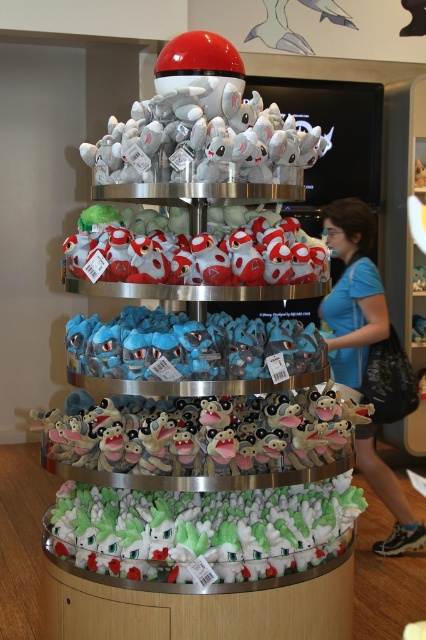
Where is `white plush toys at center`? The width and height of the screenshot is (426, 640). white plush toys at center is located at coordinates point(201,342).

Between point (184, 244) and point (112, 492), which one is positioned in front?

Point (112, 492) is more forward.

Where is `white plush toys at center`? white plush toys at center is located at coordinates (201, 342).

Between point (66, 243) and point (100, 344), which one is positioned in front?

Positioned in front is point (100, 344).

Is point (141, 552) positioned in front of point (195, 365)?

Yes, point (141, 552) is closer to viewer.

Is point (166, 513) closer to viewer compared to point (298, 323)?

Yes, point (166, 513) is in front of point (298, 323).

Where is `white plush toys at center`? The image size is (426, 640). white plush toys at center is located at coordinates (201, 342).

Is point (333, 508) positioned before point (327, 224)?

Yes, it is in front of point (327, 224).

Between point (261, 538) and point (397, 524), which one is positioned in front?

Point (261, 538) is more forward.

Find the location of a particular element. white soft plushies at bottom is located at coordinates (203, 529).

Where is `white soft plushies at bottom`? This screenshot has width=426, height=640. white soft plushies at bottom is located at coordinates (x=203, y=529).